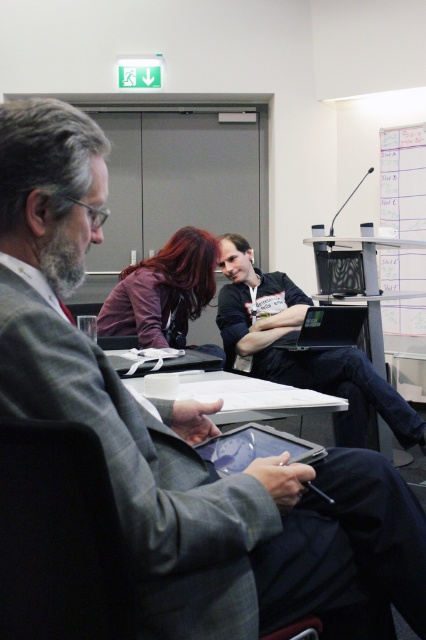
Question: Estimate the real-world distances between objects in this image. Which object is closer to the dark purple fabric shirt at center?

Choices:
 (A) black fabric laptop at center
 (B) black glossy tablet at center

Answer: (A)

Question: Is dark purple fabric shirt at center positioned behind black glossy tablet at center?

Choices:
 (A) yes
 (B) no

Answer: (A)

Question: Is black fabric laptop at center to the left of dark purple fabric shirt at center from the viewer's perspective?

Choices:
 (A) no
 (B) yes

Answer: (A)

Question: Among these objects, which one is nearest to the camera?

Choices:
 (A) dark purple fabric shirt at center
 (B) black glossy laptop at center
 (C) black glossy tablet at center
 (D) black fabric laptop at center

Answer: (C)

Question: Observing the image, what is the correct spatial positioning of black fabric laptop at center in reference to black glossy tablet at center?

Choices:
 (A) right
 (B) left

Answer: (A)

Question: Which point is farther to the camera?

Choices:
 (A) (360, 401)
 (B) (216, 243)
 (C) (250, 460)
 (D) (325, 321)

Answer: (B)